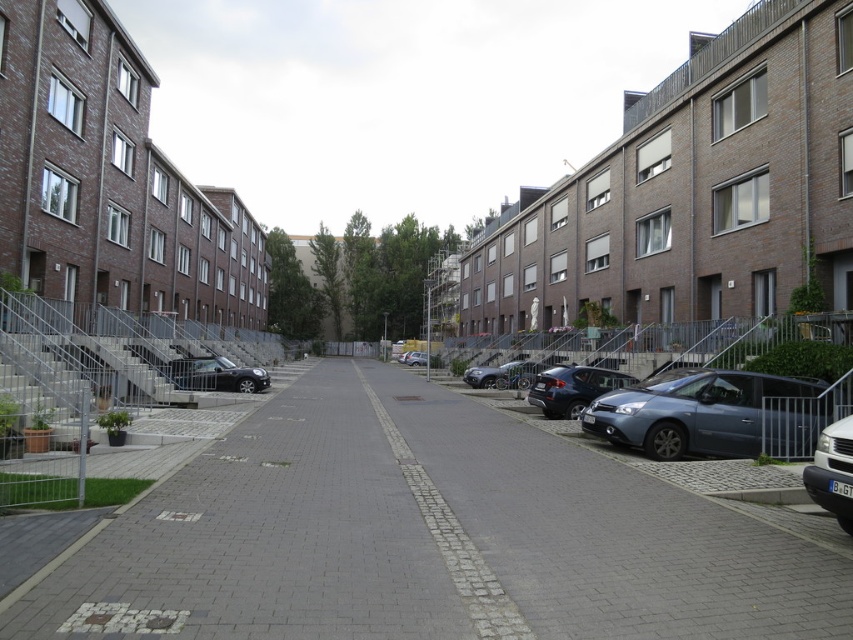
Does metallic gray car at right lie behind satin black car at center?

No, metallic gray car at right is in front of satin black car at center.

Is metallic gray car at right to the left of satin black car at center from the viewer's perspective?

No, metallic gray car at right is not to the left of satin black car at center.

Is point (634, 440) in front of point (218, 365)?

Yes, point (634, 440) is in front of point (218, 365).

Locate an element on the screen. This screenshot has width=853, height=640. metallic gray car at right is located at coordinates (x=706, y=413).

Between silver metallic suv at center-right and shiny silver car at center-right, which one is positioned lower?

shiny silver car at center-right is below.

Does silver metallic suv at center-right have a lesser width compared to shiny silver car at center-right?

No, silver metallic suv at center-right is not thinner than shiny silver car at center-right.

The image size is (853, 640). What are the coordinates of `silver metallic suv at center-right` in the screenshot? It's located at (572, 388).

Find the location of a particular element. The height and width of the screenshot is (640, 853). silver metallic suv at center-right is located at coordinates (572, 388).

Who is positioned more to the right, satin black car at center or satin silver sedan at center?

Positioned to the right is satin silver sedan at center.

Describe the element at coordinates (216, 374) in the screenshot. I see `satin black car at center` at that location.

Locate an element on the screen. The height and width of the screenshot is (640, 853). satin black car at center is located at coordinates (216, 374).